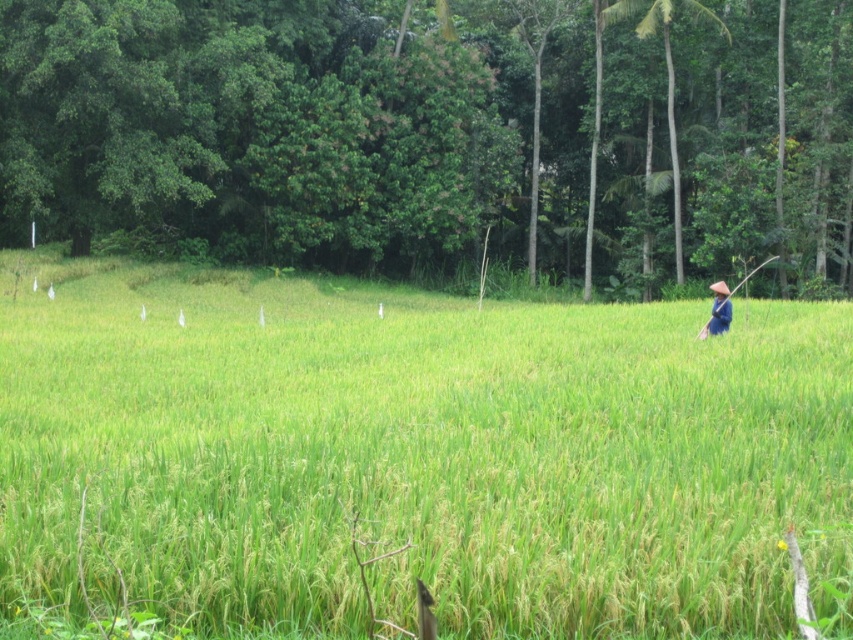
Question: Is green grassy field at center positioned in front of brown straw hat at right?

Choices:
 (A) yes
 (B) no

Answer: (A)

Question: Which of the following is the closest to the observer?

Choices:
 (A) green grassy field at center
 (B) brown straw hat at right

Answer: (A)

Question: Can you confirm if green grassy field at center is positioned above brown straw hat at right?

Choices:
 (A) no
 (B) yes

Answer: (A)

Question: Which object is farther from the camera taking this photo?

Choices:
 (A) brown straw hat at right
 (B) green grassy field at center

Answer: (A)

Question: Considering the relative positions of green grassy field at center and brown straw hat at right in the image provided, where is green grassy field at center located with respect to brown straw hat at right?

Choices:
 (A) below
 (B) above

Answer: (A)